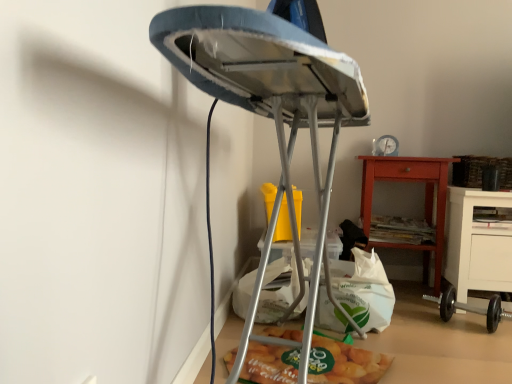
Identify the location of vacant area located to the right-hand side of white paper bag at lower center. This screenshot has width=512, height=384. (442, 330).